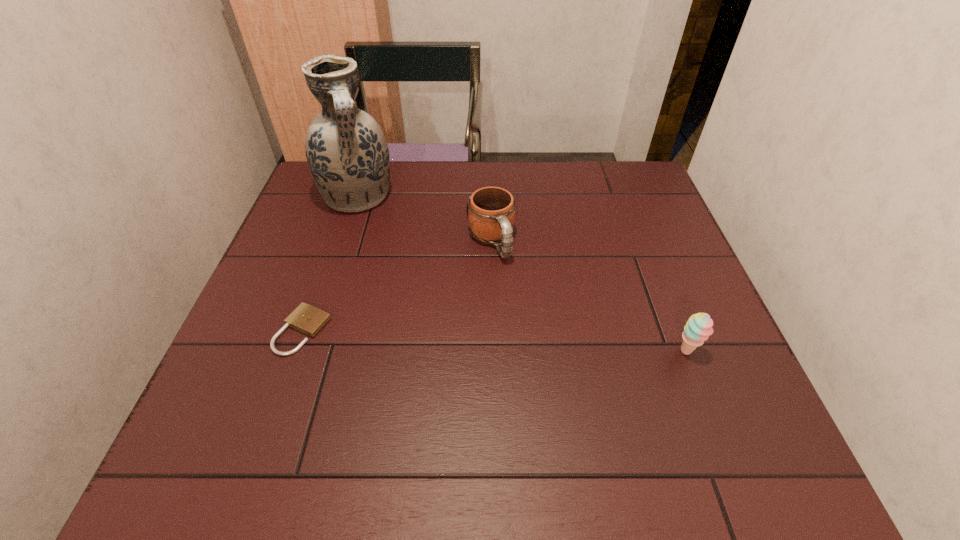
Find the location of `padlock`. padlock is located at coordinates (307, 319).

At what (x,y) coordinates should I click in order to perform the action: click on the rightmost object. Please return your answer as a coordinate pair (x, y). Image resolution: width=960 pixels, height=540 pixels. Looking at the image, I should click on (698, 328).

Where is `the tallest object`? the tallest object is located at coordinates (346, 150).

Locate an element on the screen. mug is located at coordinates (490, 211).

Where is `free space located on the back of the shortest object`? Image resolution: width=960 pixels, height=540 pixels. free space located on the back of the shortest object is located at coordinates (335, 238).

Find the location of `vacant space located on the back of the sherbert`. vacant space located on the back of the sherbert is located at coordinates (669, 306).

Locate an element on the screen. The width and height of the screenshot is (960, 540). free space located with the handle on the side of the vase is located at coordinates (398, 269).

Locate an element on the screen. Image resolution: width=960 pixels, height=540 pixels. vacant space located 0.140m with the handle on the side of the vase is located at coordinates (386, 248).

I want to click on vacant space located with the handle on the side of the vase, so click(x=423, y=314).

You are a GUI agent. You are given a task and a screenshot of the screen. Output one action in this format:
    pyautogui.click(x=<x>, y=<y>)
    Task: Click on the blank area located on the side of the second object from right to left with the handle
    The width and height of the screenshot is (960, 540).
    Given the screenshot: What is the action you would take?
    pyautogui.click(x=512, y=289)